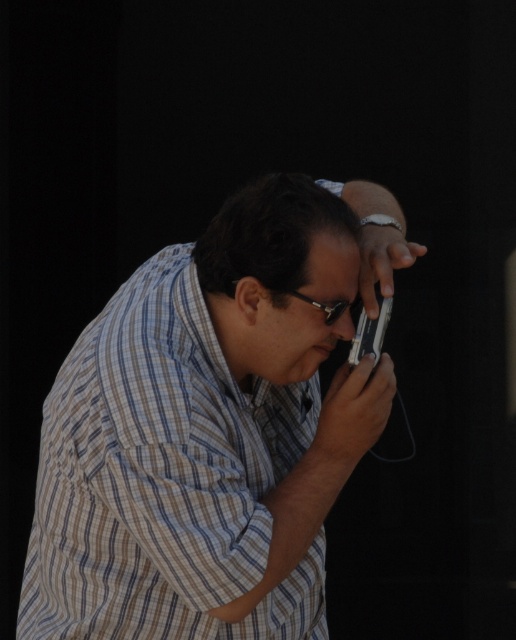
Question: Is striped cotton shirt at center to the left of sleek silver phone at center from the viewer's perspective?

Choices:
 (A) no
 (B) yes

Answer: (B)

Question: Observing the image, what is the correct spatial positioning of striped cotton shirt at center in reference to sleek silver phone at center?

Choices:
 (A) left
 (B) right

Answer: (A)

Question: Where is striped cotton shirt at center located in relation to sleek silver phone at center in the image?

Choices:
 (A) left
 (B) right

Answer: (A)

Question: Which of the following is the closest to the observer?

Choices:
 (A) (345, 380)
 (B) (360, 328)

Answer: (A)